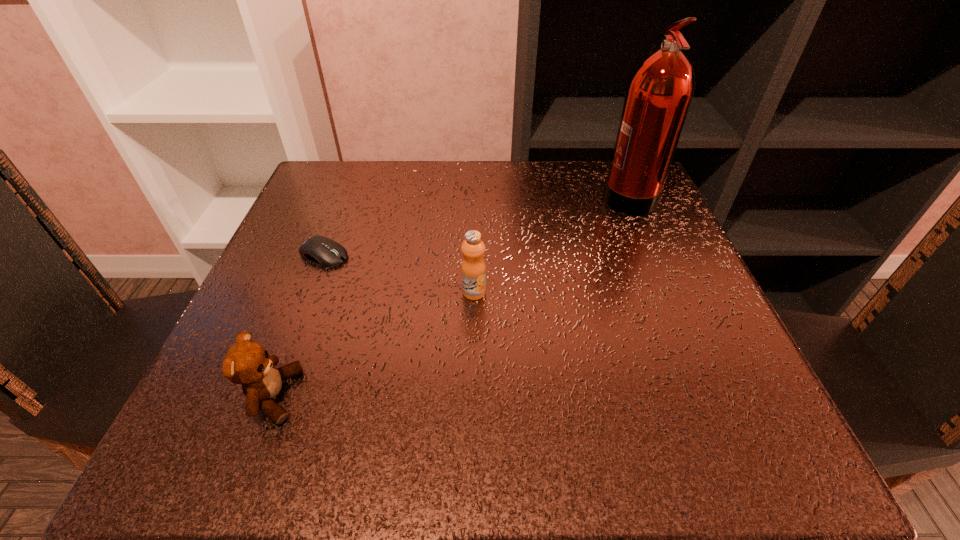
Find the location of a particular element. vacant space situated 0.060m on the front label of the third object from left to right is located at coordinates (473, 328).

This screenshot has height=540, width=960. In order to click on free space located 0.200m on the front-facing side of the nearest object in this screenshot , I will do `click(442, 396)`.

Find the location of `free location located 0.320m on the front of the second farthest object`. free location located 0.320m on the front of the second farthest object is located at coordinates (254, 435).

What are the coordinates of `object positioned at the far edge` in the screenshot? It's located at 659,93.

Locate an element on the screen. Image resolution: width=960 pixels, height=540 pixels. object that is at the near edge is located at coordinates (248, 363).

Identify the location of teddy bear that is positioned at the left edge. (248, 363).

Find the location of `computer equipment at the left edge`. computer equipment at the left edge is located at coordinates (326, 252).

The width and height of the screenshot is (960, 540). What are the coordinates of `object at the right edge` in the screenshot? It's located at pos(659,93).

Identify the location of object that is at the near left corner. (248, 363).

Where is `object located at the far right corner`? object located at the far right corner is located at coordinates (659, 93).